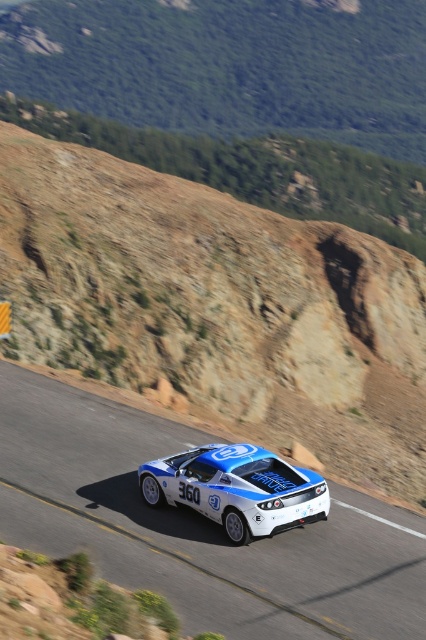
Question: Does white glossy asphalt at center appear on the left side of shiny blue racing car at center?

Choices:
 (A) yes
 (B) no

Answer: (A)

Question: Which point is closer to the camera taking this photo?

Choices:
 (A) (299, 573)
 (B) (241, 497)

Answer: (A)

Question: Is white glossy asphalt at center to the right of shiny blue racing car at center from the viewer's perspective?

Choices:
 (A) no
 (B) yes

Answer: (A)

Question: Which of the following is the farthest from the observer?

Choices:
 (A) white glossy asphalt at center
 (B) shiny blue racing car at center

Answer: (B)

Question: Does white glossy asphalt at center appear on the right side of shiny blue racing car at center?

Choices:
 (A) no
 (B) yes

Answer: (A)

Question: Which point is closer to the camera?

Choices:
 (A) (290, 540)
 (B) (267, 481)

Answer: (B)